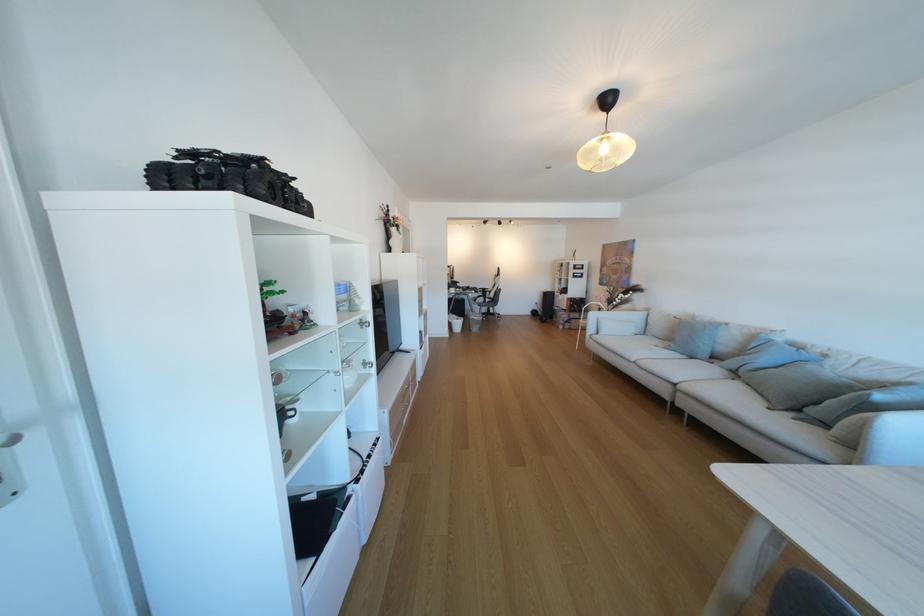
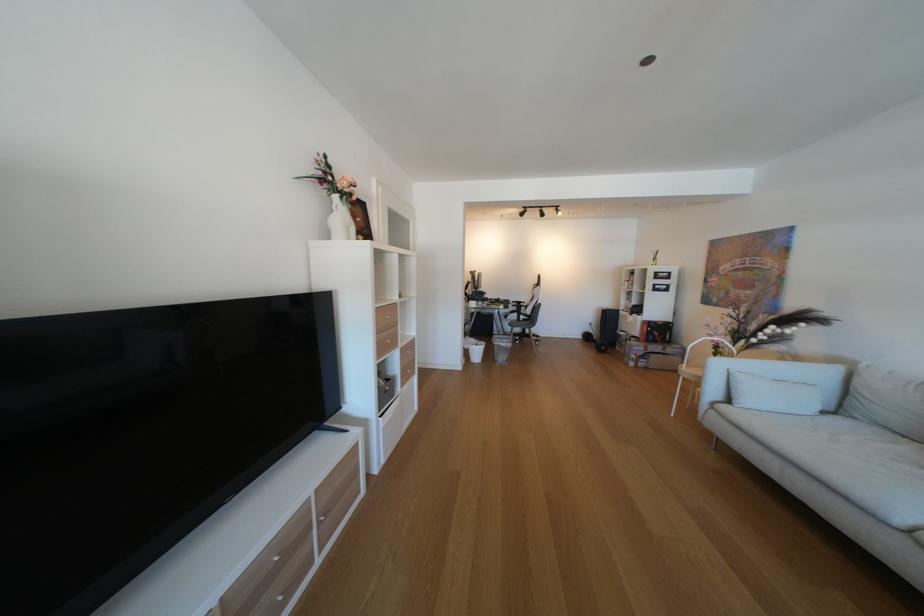
Where in the second image is the point corresponding to pixel 602 331 from the first image?

(723, 392)